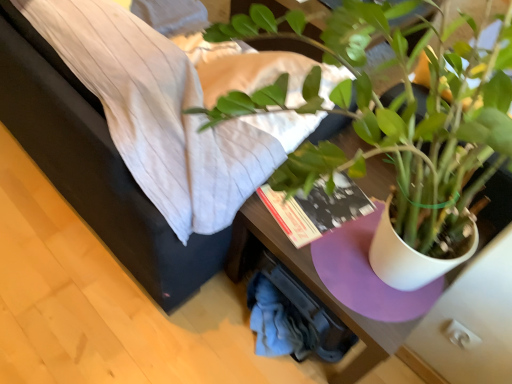
Question: In terms of width, does white textured sheet at upper center look wider or thinner when compared to green matte plant at center?

Choices:
 (A) wide
 (B) thin

Answer: (A)

Question: In the image, is white textured sheet at upper center positioned in front of or behind green matte plant at center?

Choices:
 (A) front
 (B) behind

Answer: (B)

Question: Considering the positions of white textured sheet at upper center and green matte plant at center in the image, is white textured sheet at upper center taller or shorter than green matte plant at center?

Choices:
 (A) tall
 (B) short

Answer: (B)

Question: Would you say green matte plant at center is to the left or to the right of white textured sheet at upper center in the picture?

Choices:
 (A) right
 (B) left

Answer: (A)

Question: Considering the positions of green matte plant at center and white textured sheet at upper center in the image, is green matte plant at center bigger or smaller than white textured sheet at upper center?

Choices:
 (A) small
 (B) big

Answer: (A)

Question: Is green matte plant at center taller or shorter than white textured sheet at upper center?

Choices:
 (A) tall
 (B) short

Answer: (A)

Question: Is green matte plant at center inside or outside of white textured sheet at upper center?

Choices:
 (A) inside
 (B) outside

Answer: (B)